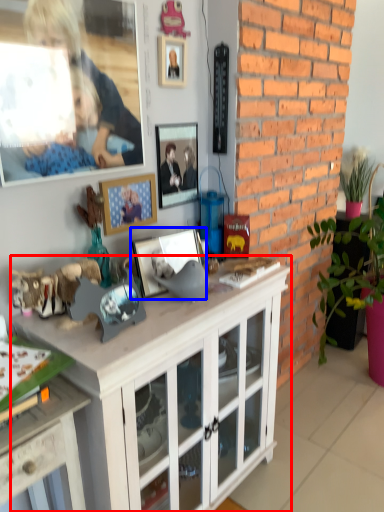
Question: Which point is further to the camera, cabinetry (highlighted by a red box) or picture frame (highlighted by a blue box)?

Choices:
 (A) cabinetry
 (B) picture frame

Answer: (B)